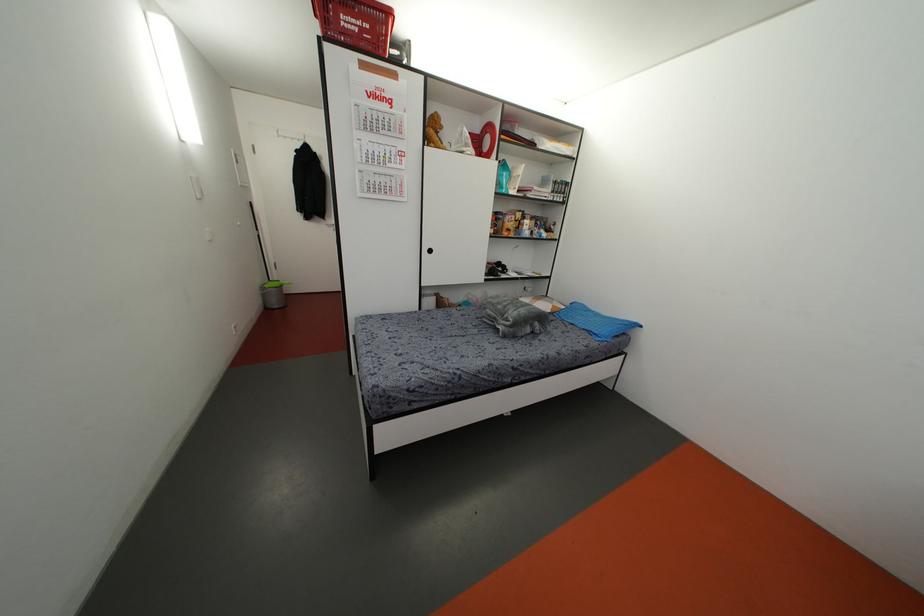
The width and height of the screenshot is (924, 616). In order to click on grey blanket in this screenshot , I will do `click(458, 357)`.